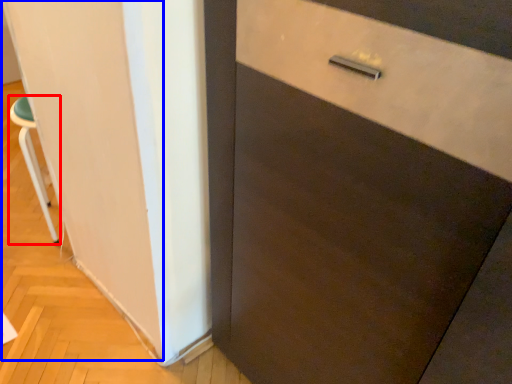
Question: Which object is further to the camera taking this photo, furniture (highlighted by a red box) or barn door (highlighted by a blue box)?

Choices:
 (A) furniture
 (B) barn door

Answer: (A)